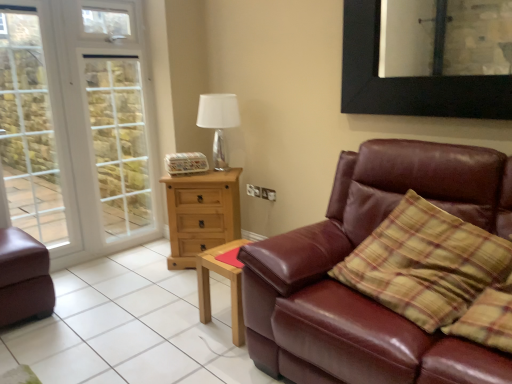
Question: From a real-world perspective, is white glass screen door at left under white glass window at left?

Choices:
 (A) yes
 (B) no

Answer: (B)

Question: Is white glass screen door at left to the left of white glass window at left from the viewer's perspective?

Choices:
 (A) no
 (B) yes

Answer: (A)

Question: Does white glass screen door at left have a lesser width compared to white glass window at left?

Choices:
 (A) yes
 (B) no

Answer: (B)

Question: Is white glass screen door at left to the right of white glass window at left from the viewer's perspective?

Choices:
 (A) yes
 (B) no

Answer: (A)

Question: Does white glass screen door at left come in front of white glass window at left?

Choices:
 (A) yes
 (B) no

Answer: (B)

Question: Is white glass screen door at left completely or partially outside of white glass window at left?

Choices:
 (A) no
 (B) yes

Answer: (B)

Question: Is brown leather couch at lower right completely or partially outside of light wood rectangular table at center?

Choices:
 (A) no
 (B) yes

Answer: (B)

Question: From a real-world perspective, is brown leather couch at lower right beneath light wood rectangular table at center?

Choices:
 (A) no
 (B) yes

Answer: (B)

Question: Is brown leather couch at lower right oriented towards light wood rectangular table at center?

Choices:
 (A) no
 (B) yes

Answer: (A)

Question: Considering the relative sizes of brown leather couch at lower right and light wood rectangular table at center in the image provided, is brown leather couch at lower right bigger than light wood rectangular table at center?

Choices:
 (A) no
 (B) yes

Answer: (B)

Question: Is brown leather couch at lower right wider than light wood rectangular table at center?

Choices:
 (A) yes
 (B) no

Answer: (A)

Question: Can you confirm if brown leather couch at lower right is thinner than light wood rectangular table at center?

Choices:
 (A) no
 (B) yes

Answer: (A)

Question: Is white glossy table lamp at upper center positioned before white glass screen door at left?

Choices:
 (A) yes
 (B) no

Answer: (B)